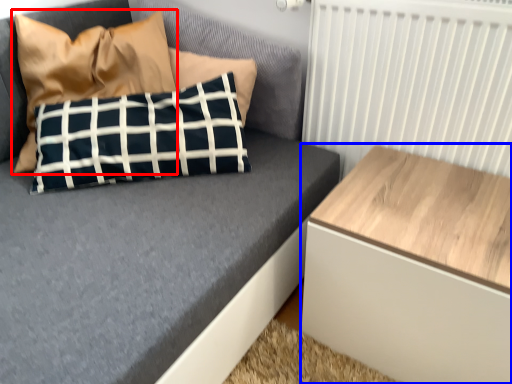
Question: Which object appears closest to the camera in this image, pillow (highlighted by a red box) or table (highlighted by a blue box)?

Choices:
 (A) pillow
 (B) table

Answer: (B)